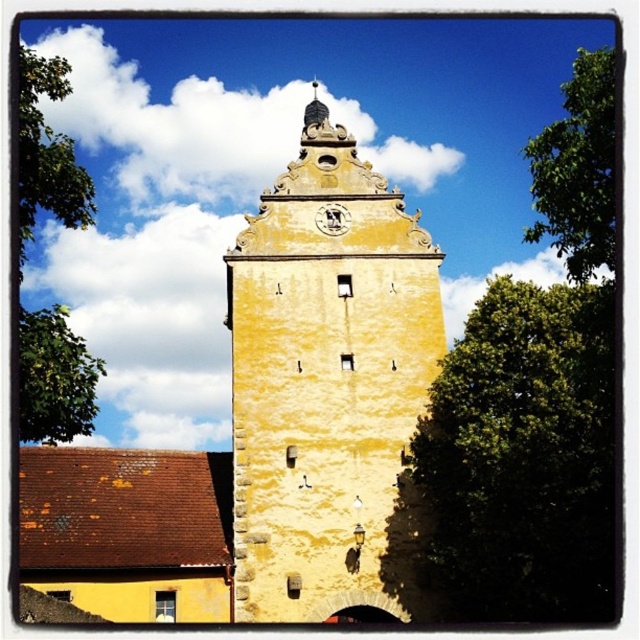
You are a maintenance worker needing to reach both the yellow stone tower at center and the gold textured clock at upper center for inspection. Given that your ladder can extend up to 5 meters, can you safely reach both objects with the ladder without moving it?

The yellow stone tower at center and gold textured clock at upper center are 6.03 meters apart. Since the ladder can only extend up to 5 meters, it is not long enough to reach both objects without moving it.

You are standing in front of the tower and want to determine which of the two green leafy trees is taller. The trees are labeled as the green leafy tree at upper right and the green leafy tree at left. Based on their positions and any visible characteristics, which tree is taller?

The green leafy tree at upper right is taller than the green leafy tree at left according to the description.